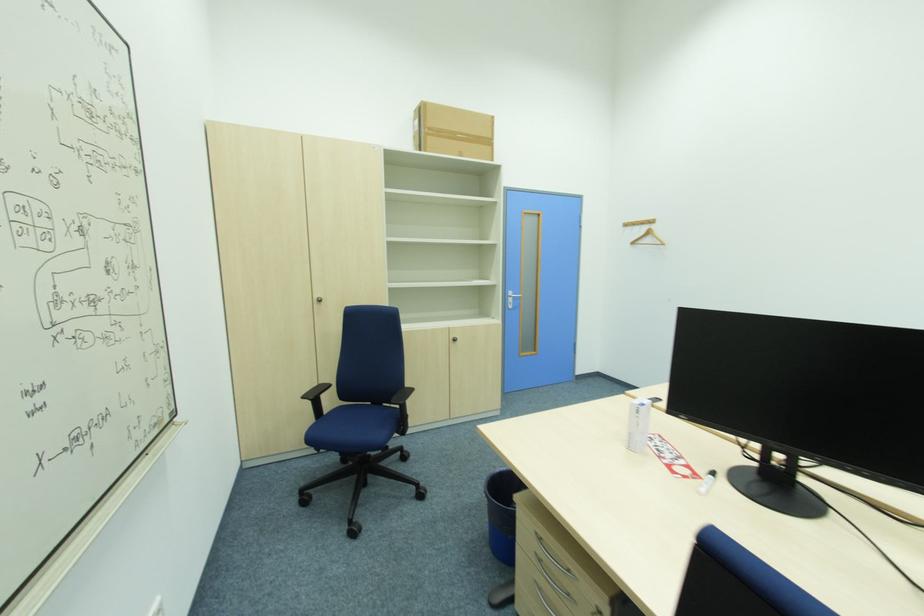
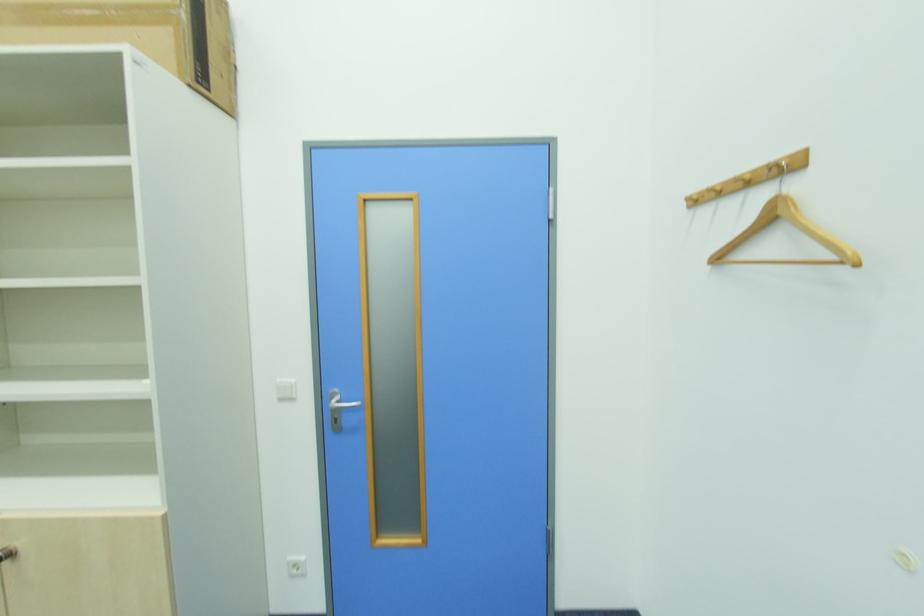
Which direction would the cameraman need to move to produce the second image?

The movement direction of the cameraman is right, forward.